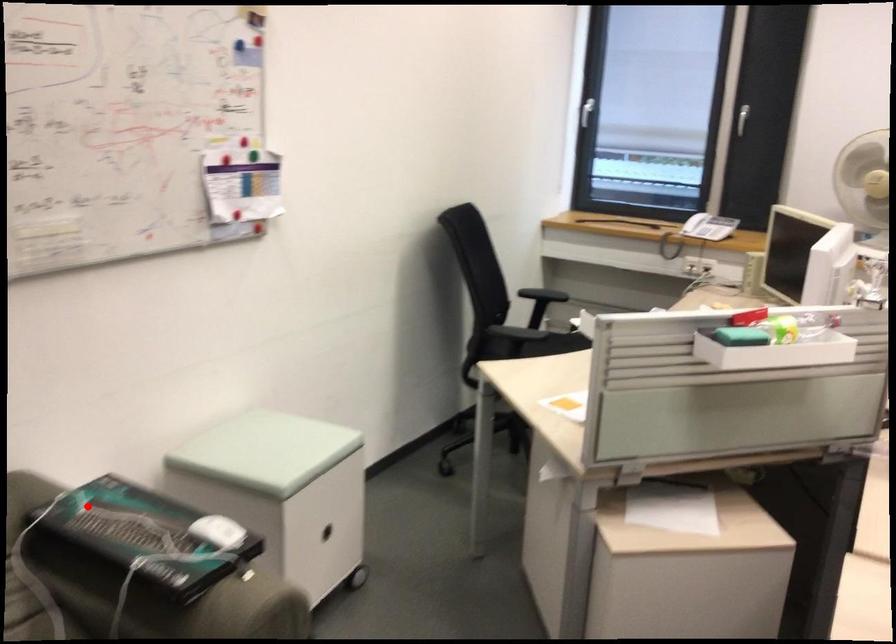
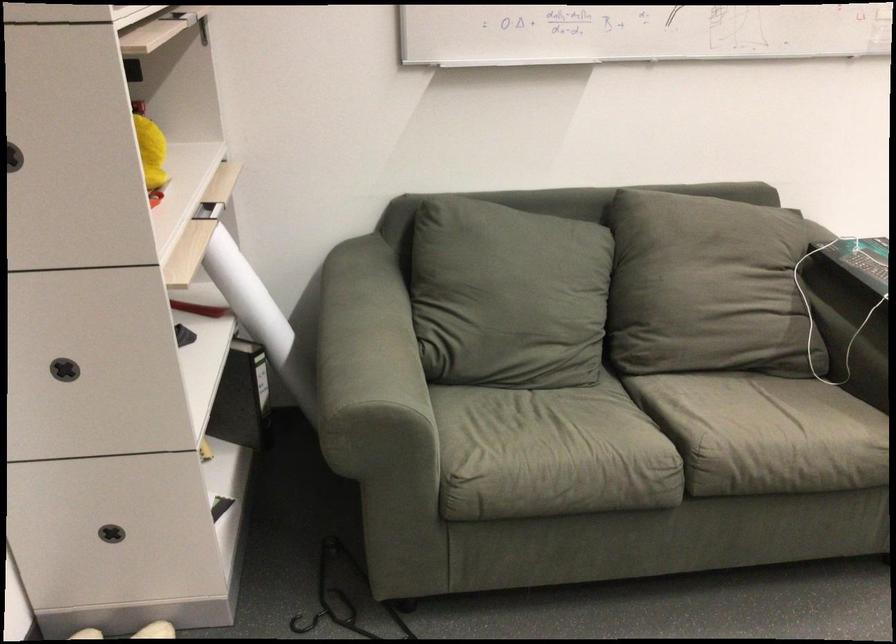
In the second image, find the point that corresponds to the highlighted location in the first image.

(860, 259)